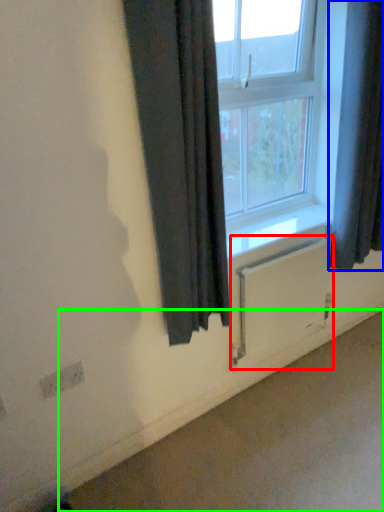
Question: Which object is the closest to the radiator (highlighted by a red box)? Choose among these: curtain (highlighted by a blue box) or concrete (highlighted by a green box).

Choices:
 (A) curtain
 (B) concrete

Answer: (A)